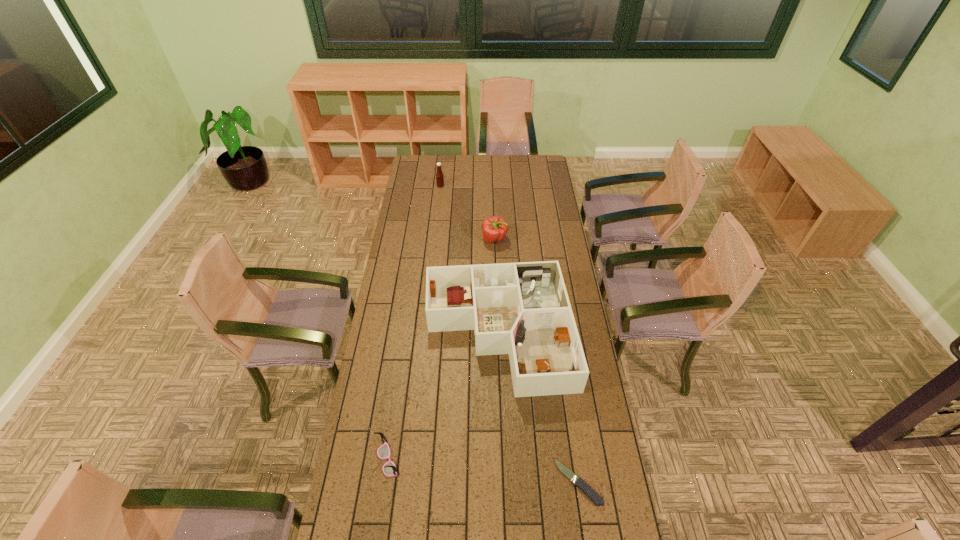
Find the location of `vacant region located on the left of the shortest object`. vacant region located on the left of the shortest object is located at coordinates (440, 482).

I want to click on object located in the left edge section of the desktop, so 389,469.

Find the location of a particular element. This screenshot has width=960, height=540. dollhouse located in the right edge section of the desktop is located at coordinates (522, 309).

At what (x,y) coordinates should I click in order to perform the action: click on steak knife present at the right edge. Please return your answer as a coordinate pair (x, y). The width and height of the screenshot is (960, 540). Looking at the image, I should click on (583, 486).

Find the location of a particular element. This screenshot has height=540, width=960. free region at the far edge of the desktop is located at coordinates (489, 155).

The height and width of the screenshot is (540, 960). Find the location of `vacant space at the left edge of the desktop`. vacant space at the left edge of the desktop is located at coordinates (376, 392).

In the image, there is a desktop. Where is `vacant space at the right edge`? The image size is (960, 540). vacant space at the right edge is located at coordinates (533, 177).

Where is `vacant area that lies between the shortest object and the spectacles`? vacant area that lies between the shortest object and the spectacles is located at coordinates (483, 471).

At what (x,y) coordinates should I click in order to perform the action: click on vacant space that's between the bell pepper and the Tabasco sauce. Please return your answer as a coordinate pair (x, y). Looking at the image, I should click on (468, 213).

Locate an element on the screen. vacant area between the spectacles and the farthest object is located at coordinates (414, 323).